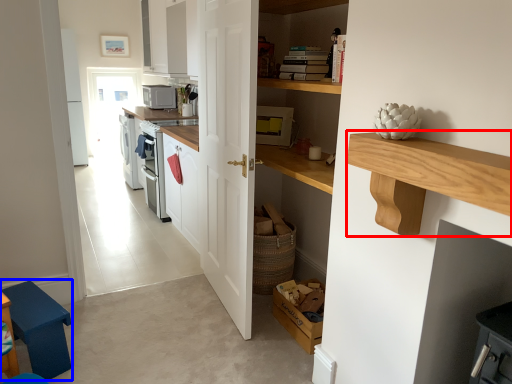
Question: Among these objects, which one is nearest to the camera, counter (highlighted by a red box) or step stool (highlighted by a blue box)?

Choices:
 (A) counter
 (B) step stool

Answer: (A)